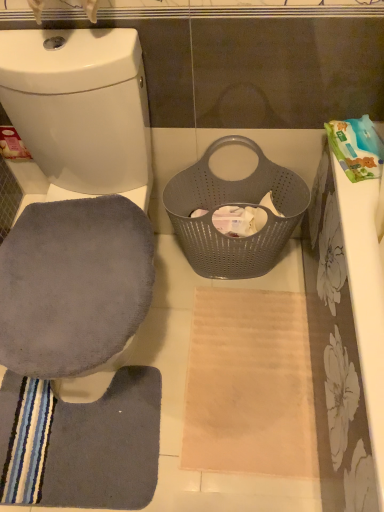
This screenshot has width=384, height=512. I want to click on free spot above gray soft mat at lower left (from a real-world perspective), so coord(87,422).